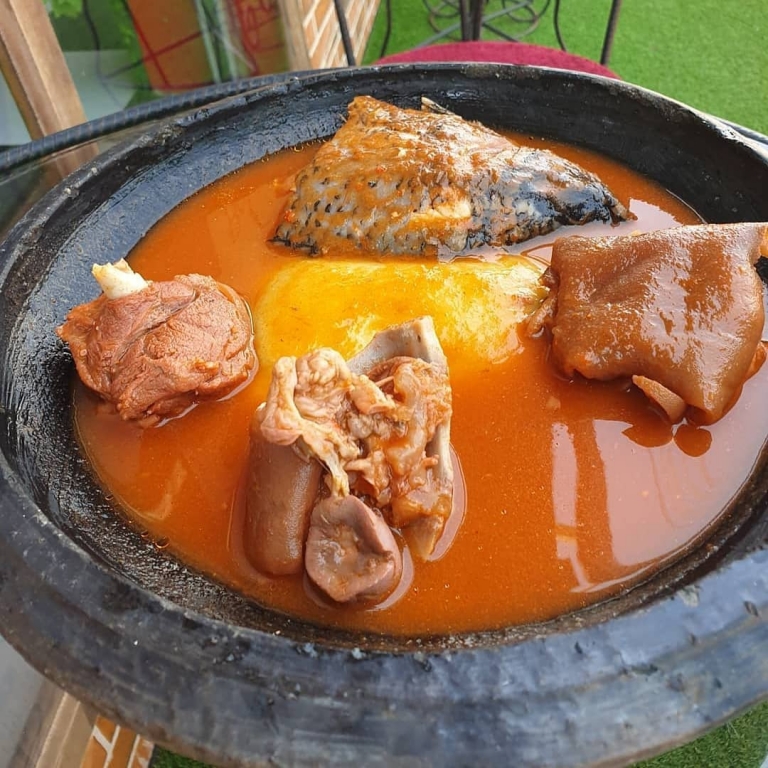
You are a GUI agent. You are given a task and a screenshot of the screen. Output one action in this format:
    pyautogui.click(x=<x>, y=<y>)
    Task: Click on the window
    Image resolution: width=768 pixels, height=768 pixels.
    Given the screenshot: What is the action you would take?
    pyautogui.click(x=124, y=58)